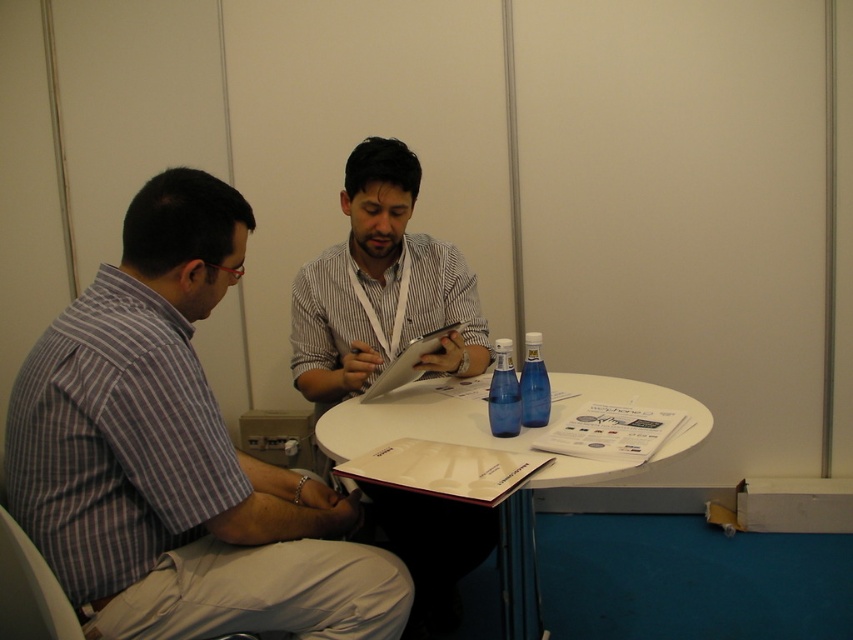
Question: Considering the real-world distances, which object is closest to the striped cotton shirt at left?

Choices:
 (A) matte striped shirt at center
 (B) blue glass bottle at center

Answer: (A)

Question: Is striped cotton shirt at left below white paper clipboard at center?

Choices:
 (A) no
 (B) yes

Answer: (B)

Question: Which point is closer to the camera taking this photo?

Choices:
 (A) pyautogui.click(x=444, y=584)
 (B) pyautogui.click(x=405, y=356)

Answer: (B)

Question: Among these points, which one is farthest from the camera?

Choices:
 (A) (508, 376)
 (B) (459, 330)
 (C) (384, 564)
 (D) (381, 340)

Answer: (B)

Question: Is blue plastic bottle at center in front of white paper clipboard at center?

Choices:
 (A) yes
 (B) no

Answer: (A)

Question: Can you confirm if matte striped shirt at center is positioned to the left of white plastic table at center?

Choices:
 (A) no
 (B) yes

Answer: (B)